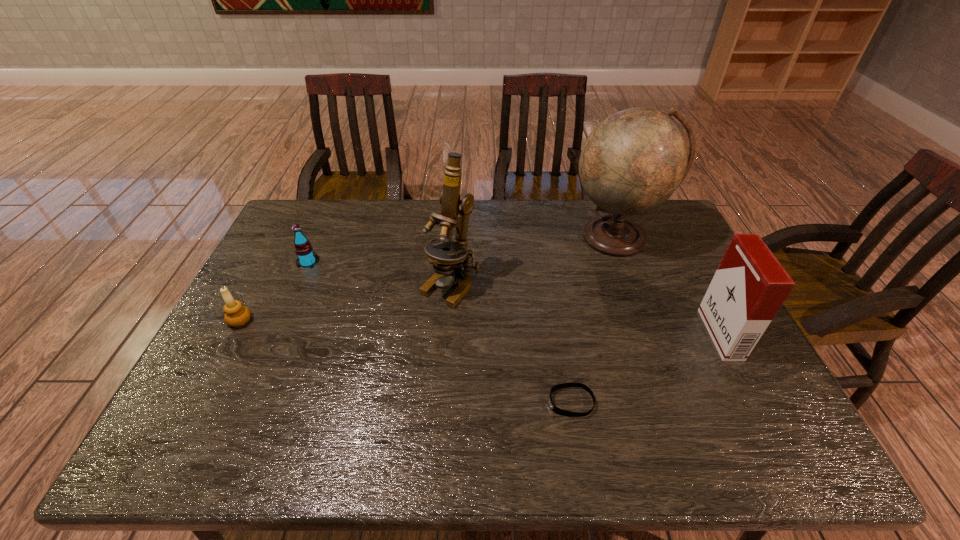
The image size is (960, 540). In order to click on globe in this screenshot , I will do `click(633, 161)`.

Locate an element on the screen. The image size is (960, 540). the fourth object from right to left is located at coordinates (446, 256).

Locate an element on the screen. This screenshot has height=540, width=960. cigarette_case is located at coordinates (750, 285).

Identify the location of soda. This screenshot has height=540, width=960. (306, 258).

Where is `candle_holder`? candle_holder is located at coordinates (236, 314).

Find the location of `the third object from right to left`. the third object from right to left is located at coordinates (557, 410).

This screenshot has height=540, width=960. Identify the location of wristband. (557, 410).

In order to click on blank space located on the front-facing side of the globe in this screenshot , I will do `click(660, 354)`.

Image resolution: width=960 pixels, height=540 pixels. Find the location of `free space located on the front of the microscope`. free space located on the front of the microscope is located at coordinates (442, 413).

Where is `vacant space located 0.260m on the front-facing side of the fourth shortest object`? Image resolution: width=960 pixels, height=540 pixels. vacant space located 0.260m on the front-facing side of the fourth shortest object is located at coordinates (613, 334).